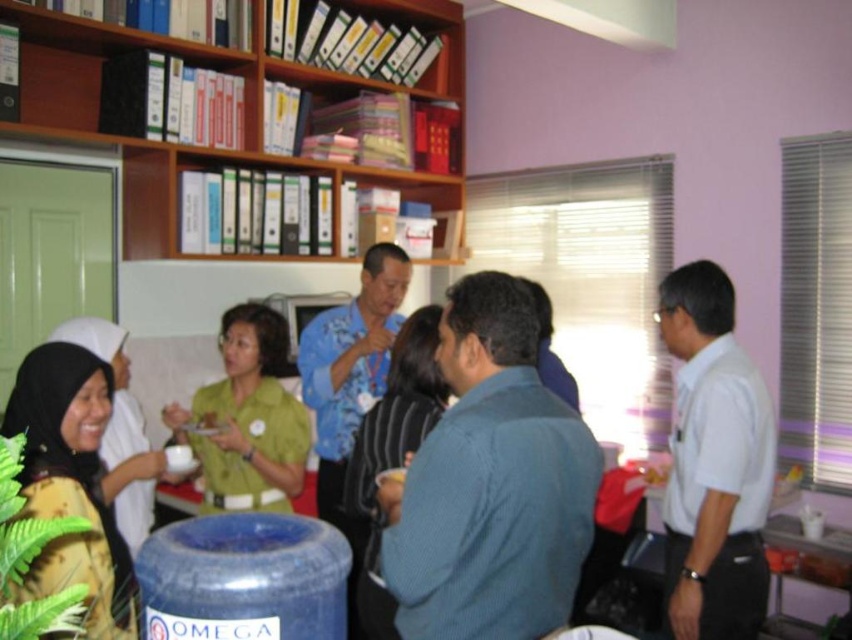
Question: Is yellow printed fabric at lower left above green matte shirt at center?

Choices:
 (A) yes
 (B) no

Answer: (B)

Question: Where is wooden bookshelf at upper center located in relation to green matte shirt at center in the image?

Choices:
 (A) below
 (B) above

Answer: (B)

Question: Is wooden bookshelf at upper center thinner than yellow printed fabric at lower left?

Choices:
 (A) no
 (B) yes

Answer: (A)

Question: Which of these objects is positioned closest to the wooden bookshelf at upper center?

Choices:
 (A) blue textured shirt at center
 (B) yellow printed fabric at lower left

Answer: (B)

Question: Which point is closer to the camera taking this photo?

Choices:
 (A) (390, 13)
 (B) (41, 380)
 (C) (232, 314)
 (D) (694, 448)

Answer: (B)

Question: Among these objects, which one is farthest from the camera?

Choices:
 (A) blue textured shirt at center
 (B) yellow printed fabric at lower left
 (C) green matte shirt at center
 (D) white shirt at right

Answer: (C)